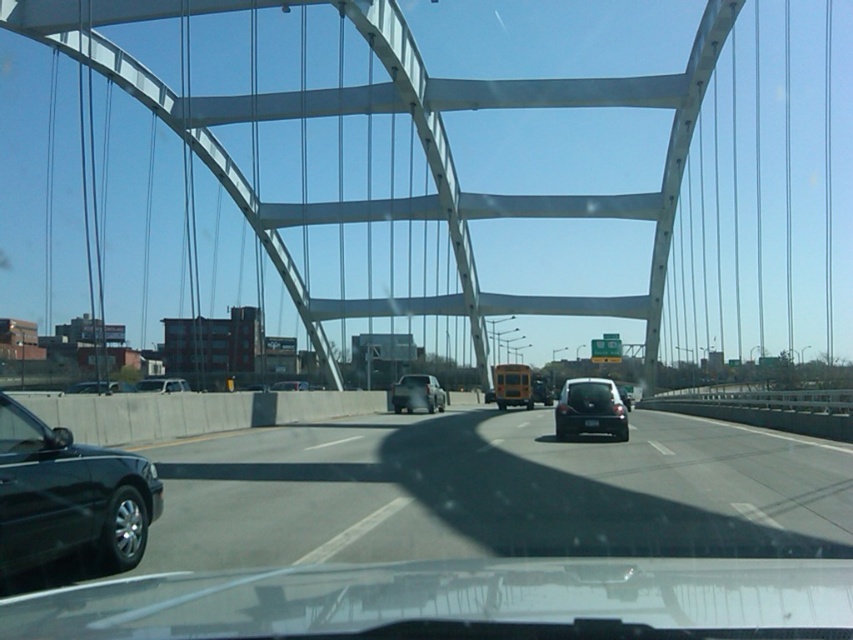
Can you confirm if white matte van at center is taller than matte black sedan at center?

Correct, white matte van at center is much taller as matte black sedan at center.

Is point (178, 380) positioned after point (282, 384)?

No, it is in front of (282, 384).

The image size is (853, 640). I want to click on white matte van at center, so click(161, 385).

Which is behind, point (782, 228) or point (20, 564)?

The point (782, 228) is behind.

Is white metallic bridge at center further to camera compared to shiny black sedan at left?

Yes, white metallic bridge at center is further from the viewer.

Between point (807, 144) and point (125, 496), which one is positioned behind?

Positioned behind is point (807, 144).

You are a GUI agent. You are given a task and a screenshot of the screen. Output one action in this format:
    pyautogui.click(x=<x>, y=<y>)
    Task: Click on the white metallic bridge at center
    This screenshot has height=640, width=853.
    Given the screenshot: What is the action you would take?
    pyautogui.click(x=444, y=170)

Is black matte hatchback at center behind matte silver suv at center?

No, black matte hatchback at center is closer to the viewer.

Does black matte hatchback at center have a greater height compared to matte silver suv at center?

In fact, black matte hatchback at center may be shorter than matte silver suv at center.

You are a GUI agent. You are given a task and a screenshot of the screen. Output one action in this format:
    pyautogui.click(x=<x>, y=<y>)
    Task: Click on the black matte hatchback at center
    
    Given the screenshot: What is the action you would take?
    pyautogui.click(x=590, y=410)